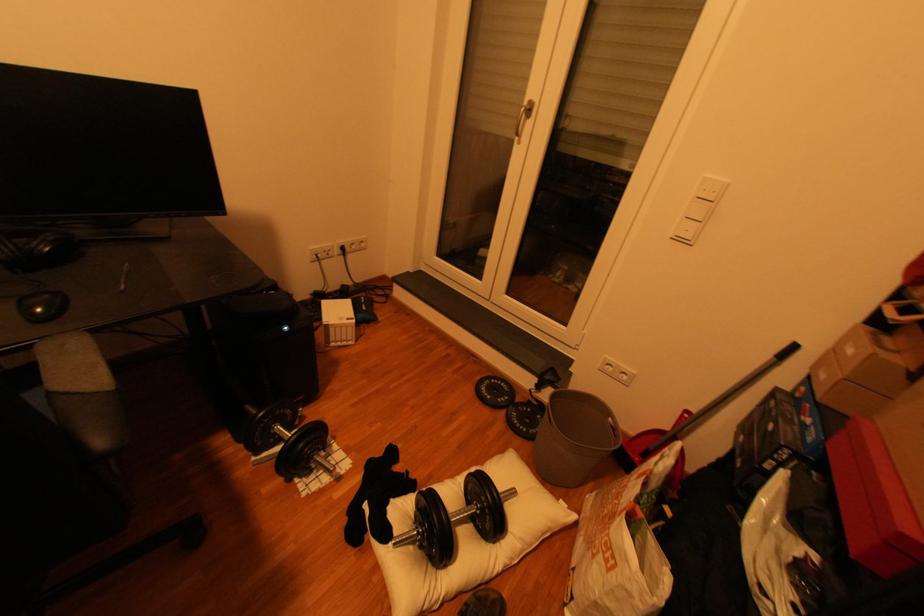
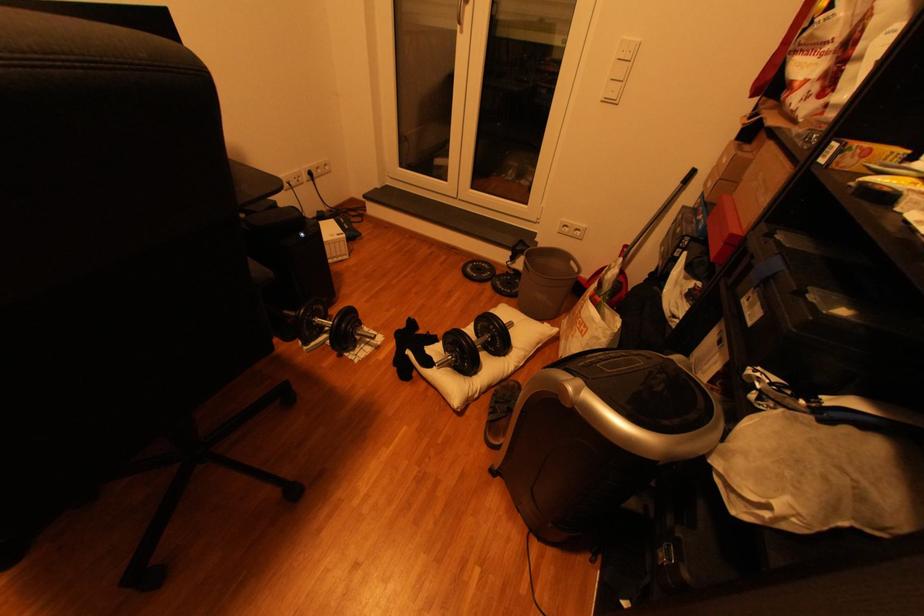
Where in the second image is the point corresponding to point (406, 533) from the first image?

(445, 361)